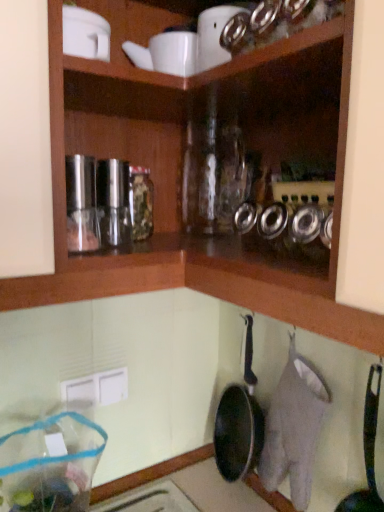
Question: Can we say black non-stick frying pan at lower right lies outside clear plastic bag at lower left?

Choices:
 (A) no
 (B) yes

Answer: (B)

Question: From the image's perspective, is black non-stick frying pan at lower right over clear plastic bag at lower left?

Choices:
 (A) yes
 (B) no

Answer: (A)

Question: From a real-world perspective, is black non-stick frying pan at lower right physically above clear plastic bag at lower left?

Choices:
 (A) no
 (B) yes

Answer: (B)

Question: Is black non-stick frying pan at lower right oriented towards clear plastic bag at lower left?

Choices:
 (A) no
 (B) yes

Answer: (A)

Question: From a real-world perspective, is black non-stick frying pan at lower right located beneath clear plastic bag at lower left?

Choices:
 (A) no
 (B) yes

Answer: (A)

Question: Considering the relative sizes of black non-stick frying pan at lower right and clear plastic bag at lower left in the image provided, is black non-stick frying pan at lower right taller than clear plastic bag at lower left?

Choices:
 (A) yes
 (B) no

Answer: (A)

Question: From the image's perspective, would you say clear plastic bag at lower left is positioned over black non-stick frying pan at lower right?

Choices:
 (A) no
 (B) yes

Answer: (A)

Question: Can you confirm if clear plastic bag at lower left is bigger than black non-stick frying pan at lower right?

Choices:
 (A) no
 (B) yes

Answer: (B)

Question: Does clear plastic bag at lower left lie in front of black non-stick frying pan at lower right?

Choices:
 (A) no
 (B) yes

Answer: (A)

Question: Can you confirm if clear plastic bag at lower left is thinner than black non-stick frying pan at lower right?

Choices:
 (A) yes
 (B) no

Answer: (B)

Question: Is clear plastic bag at lower left oriented away from black non-stick frying pan at lower right?

Choices:
 (A) yes
 (B) no

Answer: (B)

Question: From the image's perspective, is clear plastic bag at lower left below black non-stick frying pan at lower right?

Choices:
 (A) yes
 (B) no

Answer: (A)

Question: Is point (367, 453) positioned closer to the camera than point (57, 440)?

Choices:
 (A) closer
 (B) farther

Answer: (A)